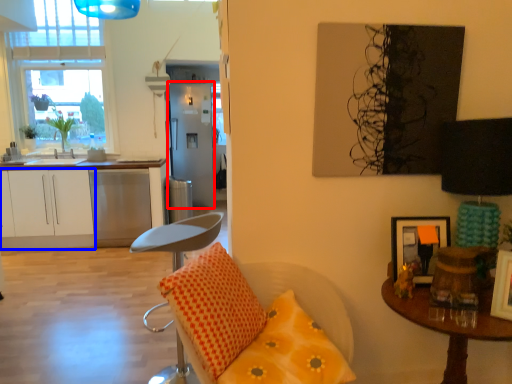
Question: Which object is further to the camera taking this photo, fridge (highlighted by a red box) or cabinetry (highlighted by a blue box)?

Choices:
 (A) fridge
 (B) cabinetry

Answer: (A)